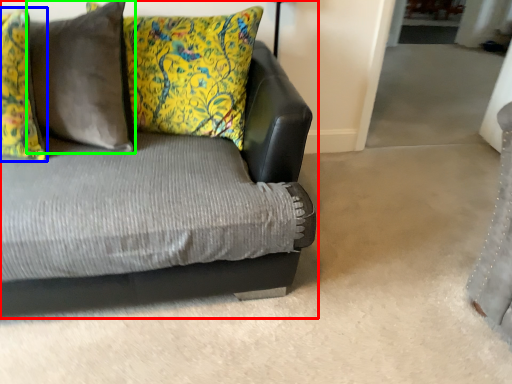
Question: Which is farther away from studio couch (highlighted by a red box)? pillow (highlighted by a blue box) or pillow (highlighted by a green box)?

Choices:
 (A) pillow
 (B) pillow

Answer: (B)